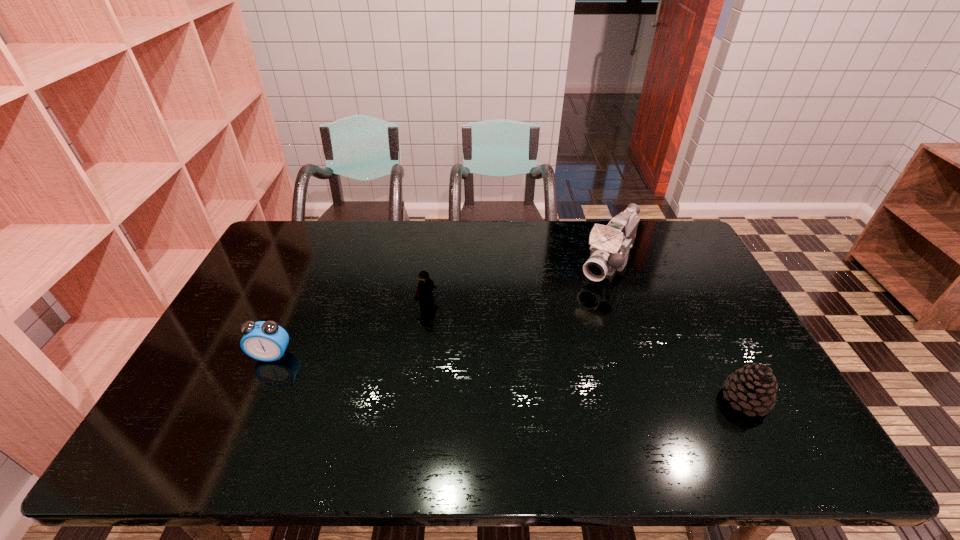
In order to click on vacant space at the far edge of the desktop in this screenshot , I will do `click(414, 261)`.

The height and width of the screenshot is (540, 960). I want to click on vacant region at the near edge of the desktop, so click(557, 395).

Locate an element on the screen. vacant space at the left edge of the desktop is located at coordinates (278, 265).

Locate an element on the screen. free space at the right edge is located at coordinates (686, 271).

Where is `free space at the far left corner of the desktop`? free space at the far left corner of the desktop is located at coordinates (281, 234).

Image resolution: width=960 pixels, height=540 pixels. I want to click on vacant area at the far right corner, so click(668, 222).

Find the location of `empty location between the third object from left to right and the third object from right to left`. empty location between the third object from left to right and the third object from right to left is located at coordinates (517, 282).

The height and width of the screenshot is (540, 960). Find the location of `free space between the leftmost object and the farthest object`. free space between the leftmost object and the farthest object is located at coordinates (440, 308).

Locate an element on the screen. This screenshot has width=960, height=540. free spot between the third nearest object and the alarm clock is located at coordinates (349, 329).

Where is `vacant area that lies between the tallest object and the Lego`? The width and height of the screenshot is (960, 540). vacant area that lies between the tallest object and the Lego is located at coordinates (517, 282).